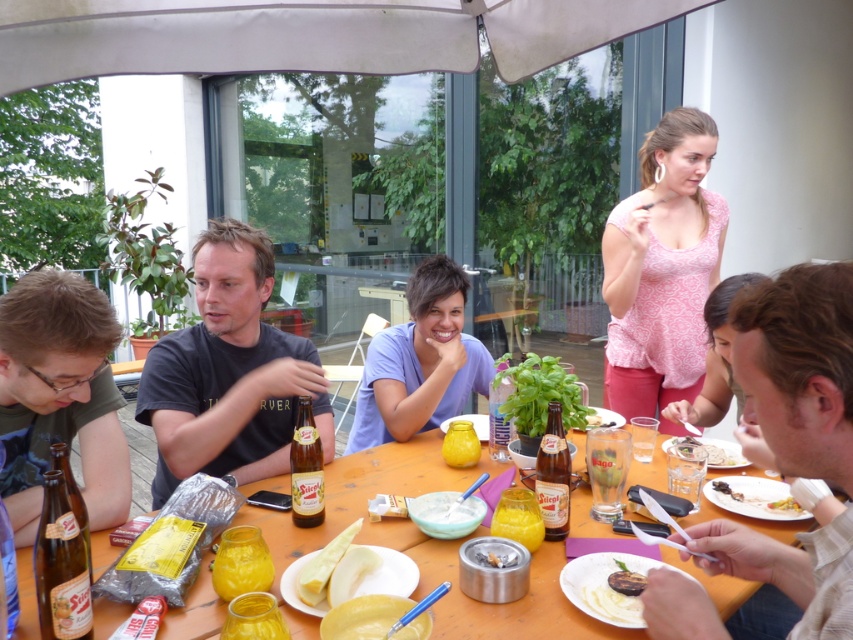
Question: Among these points, which one is farthest from the camera?

Choices:
 (A) (302, 481)
 (B) (740, 492)
 (C) (641, 632)

Answer: (B)

Question: Is dark gray t-shirt at center in front of yellow matte plate at lower right?

Choices:
 (A) no
 (B) yes

Answer: (A)

Question: Which object appears closest to the camera in this image?

Choices:
 (A) brown matte shirt at lower left
 (B) matte blue shirt at center
 (C) translucent glass beer bottle at center
 (D) yellow matte plate at lower right

Answer: (A)

Question: Which point is closer to the camera taking this photo?

Choices:
 (A) (741, 380)
 (B) (589, 528)
 (C) (782, 488)
 (D) (782, 513)

Answer: (A)

Question: Does pink floral blouse at upper right appear under white porcelain plate at lower right?

Choices:
 (A) yes
 (B) no

Answer: (B)

Question: Is wooden table at center above translucent glass bottle at center?

Choices:
 (A) no
 (B) yes

Answer: (A)